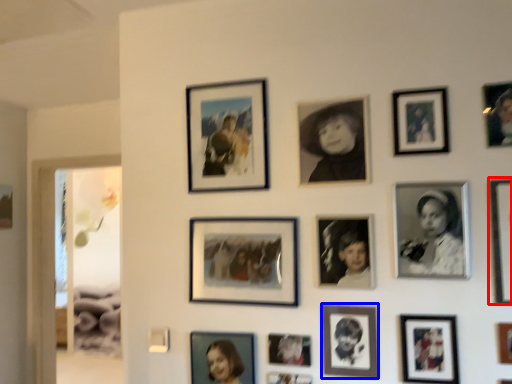
Question: Which object is further to the camera taking this photo, picture frame (highlighted by a red box) or picture frame (highlighted by a blue box)?

Choices:
 (A) picture frame
 (B) picture frame

Answer: (B)